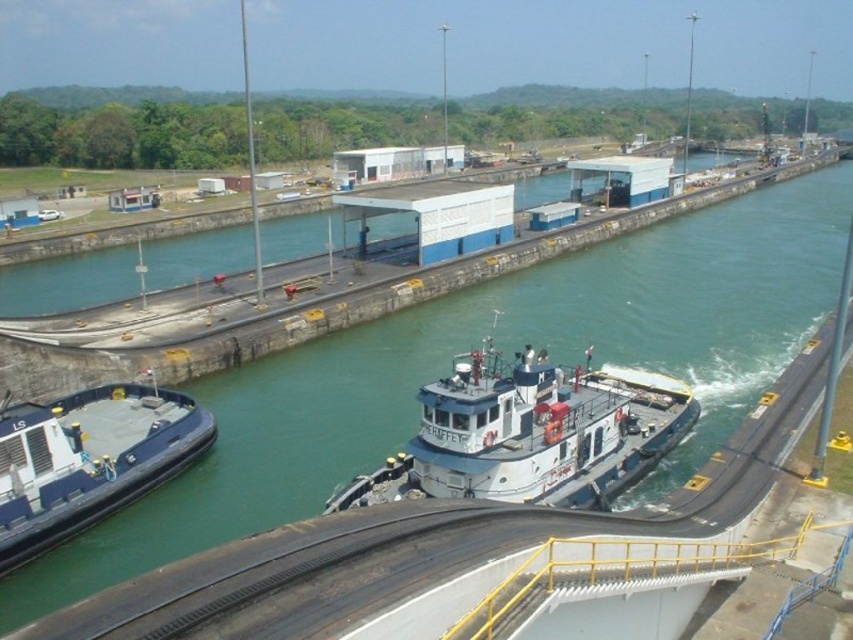
You are a maritime engineer assessing the Panama Canal locks. You observe the white matte tugboat at center and the blue rubber boat at left. Which vessel requires more space to maneuver within the lock chamber?

The white matte tugboat at center requires more space to maneuver within the lock chamber because it is larger in size than the blue rubber boat at left.

Looking at this image, you are an observer standing on the right side of the Panama Canal lock. You see the white matte tugboat at center and the blue rubber boat at left. Which boat is closer to your position?

The white matte tugboat at center is closer to your position because it is positioned to the right of the blue rubber boat at left, which is further away from the right side where you are standing.